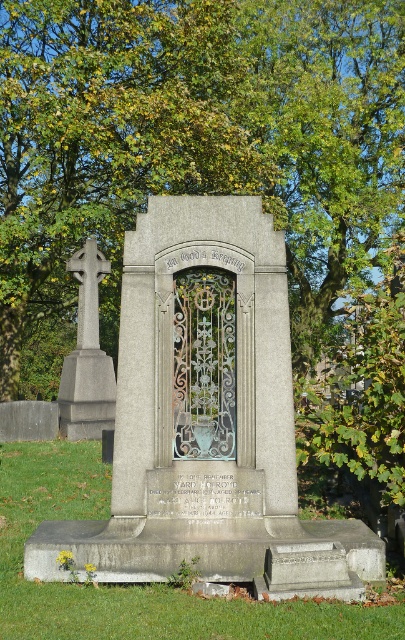
You are standing in front of the gravestone and need to determine which object is bigger between the green leafy tree at upper center and the polished stone cross at left. Can you help?

The green leafy tree at upper center is larger in size than the polished stone cross at left, so the green leafy tree at upper center is bigger.

You are a visitor at the cemetery and want to take a photo of both the gray stone monument at center and the polished stone cross at left. Which object should you focus on first to ensure both are in frame without moving the camera?

You should focus on the polished stone cross at left first because it is taller than the gray stone monument at center, so positioning the camera to include its full height will naturally include the shorter monument in the frame as well.

You are standing in front of the gravestone and want to take a photo that includes both the green leafy tree at upper center and the polished stone cross at left. Which object should be positioned to the left side of your photo?

The polished stone cross at left should be positioned to the left side of your photo because the green leafy tree at upper center is to the right of the polished stone cross at left.